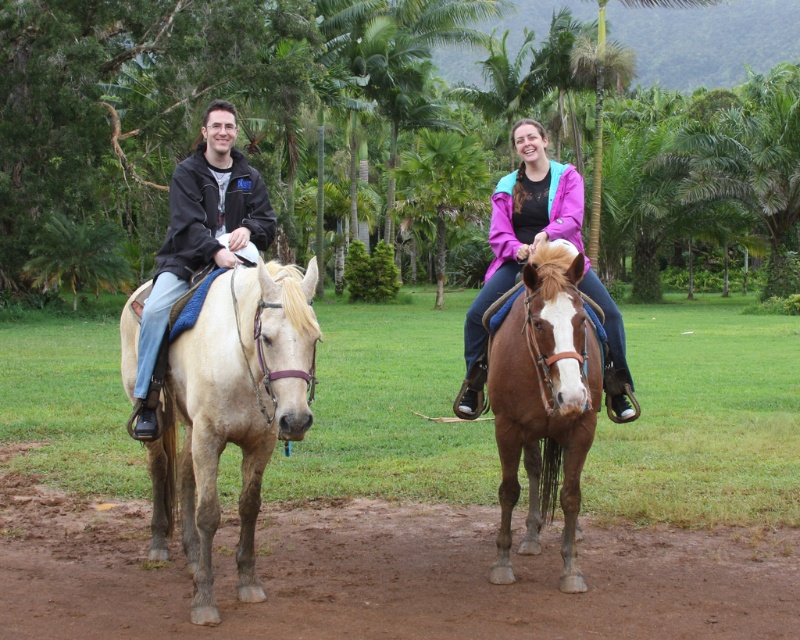
You are a photographer standing in front of the two riders and their horses. You want to take a photo that includes both points marked as point 1 at coordinates point (658, 556) and point 2 at coordinates point (564, 269). Which point should you focus on first to ensure both are in sharp focus?

You should focus on point 1 at coordinates point (658, 556) first because it is closer to the camera than point 2 at coordinates point (564, 269). This ensures that both points will be in focus when the camera adjusts the depth of field.